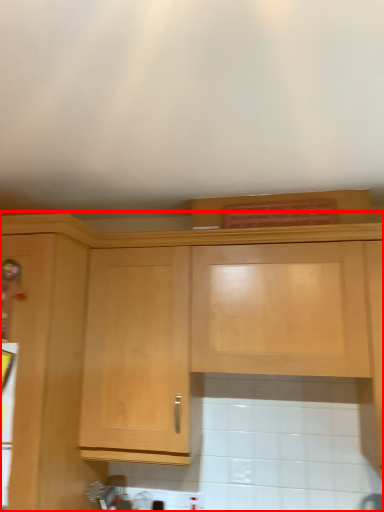
Question: From the image's perspective, what is the correct spatial relationship of cabinetry (annotated by the red box) in relation to appliance?

Choices:
 (A) above
 (B) below

Answer: (A)